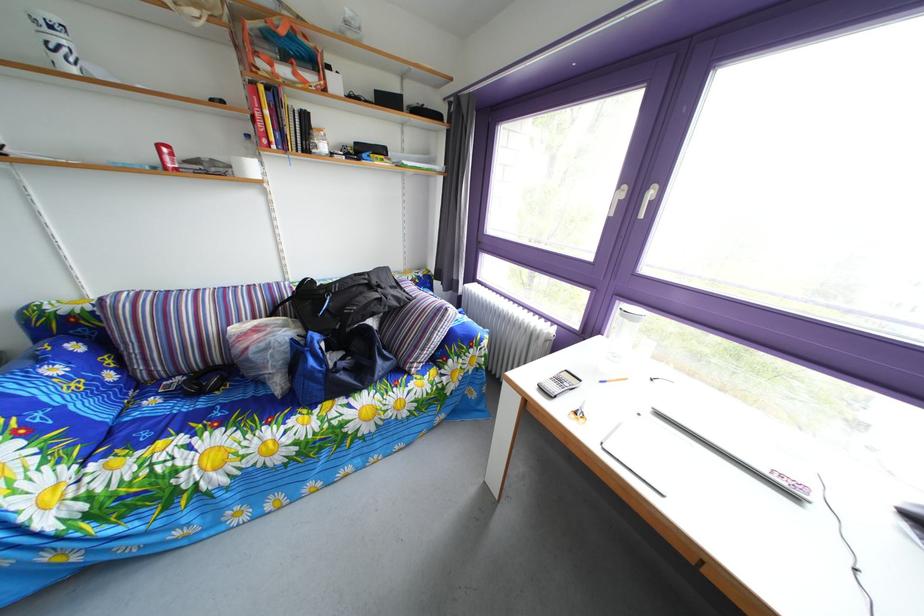
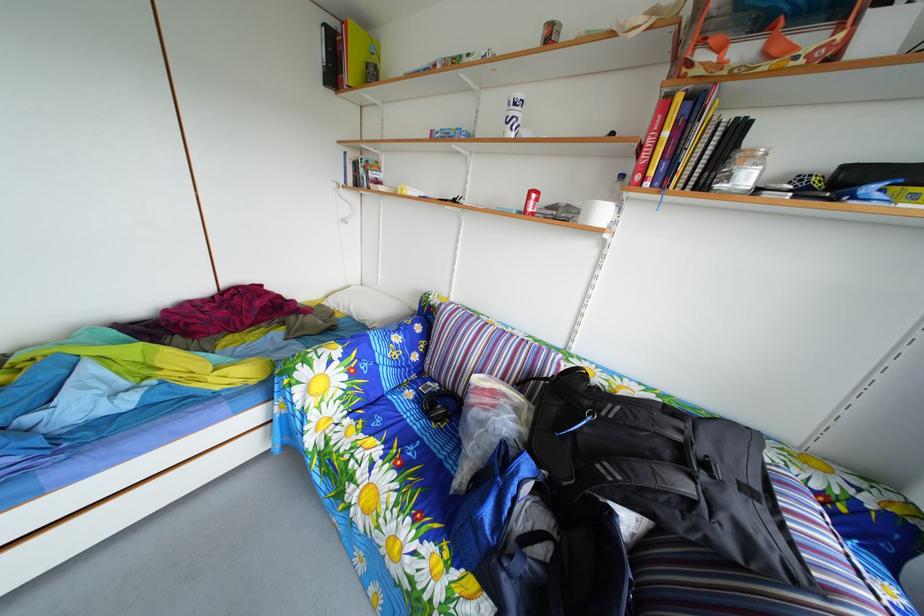
Question: The camera is either moving clockwise (left) or counter-clockwise (right) around the object. The first image is from the beginning of the video and the second image is from the end. Is the camera moving left or right when shooting the video?

Choices:
 (A) Left
 (B) Right

Answer: (B)